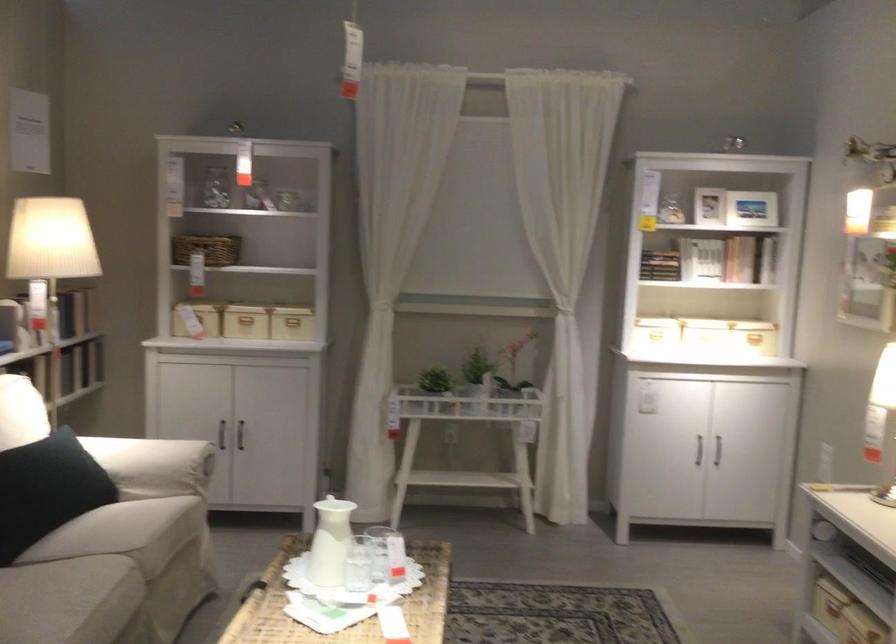
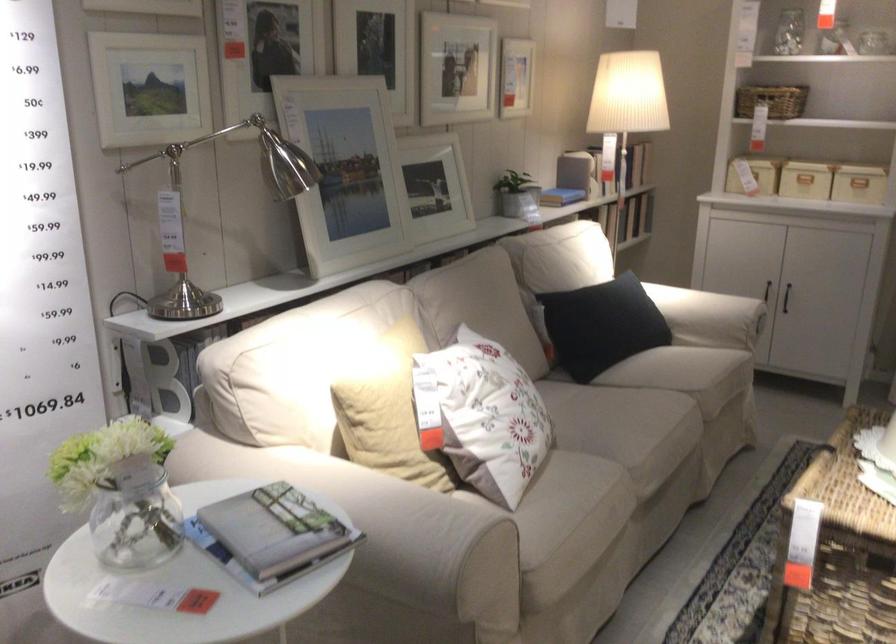
Find the pixel in the second image that matches (x=235, y=451) in the first image.

(786, 297)